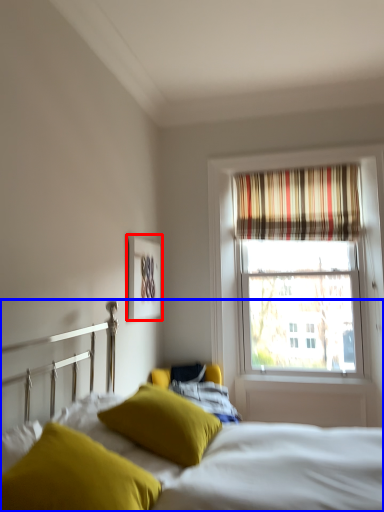
Question: Which object appears farthest to the camera in this image, picture frame (highlighted by a red box) or bed (highlighted by a blue box)?

Choices:
 (A) picture frame
 (B) bed

Answer: (A)